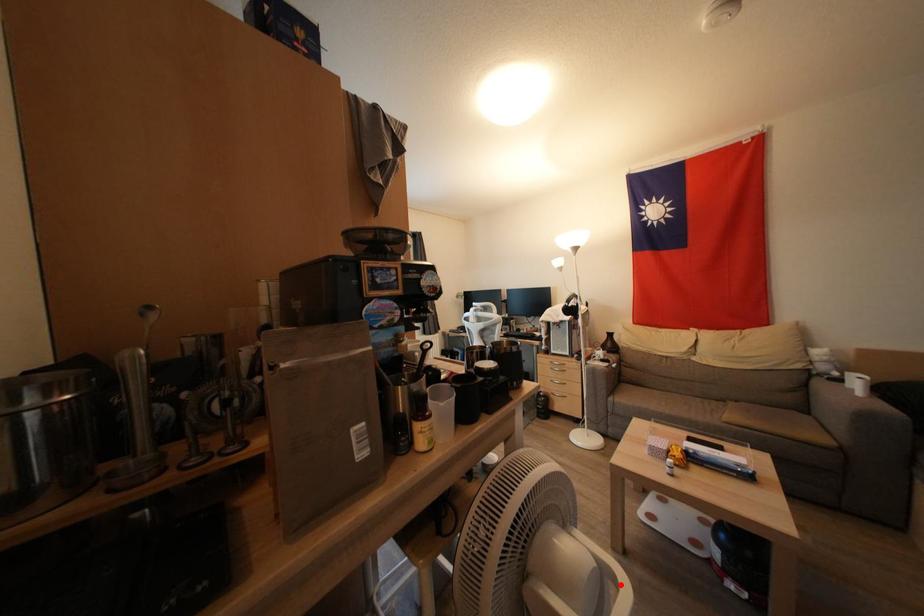
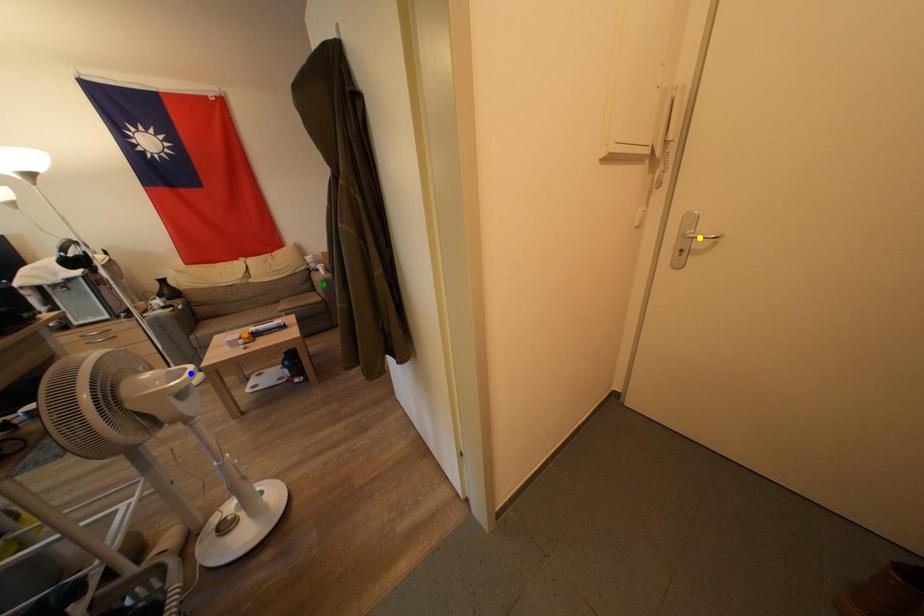
Question: I am providing you with two images of the same scene from different viewpoints. A red point is marked on the first image. You are given multiple points on the second image. Can you choose the point in image 2 that corresponds to the point in image 1?

Choices:
 (A) yellow point
 (B) blue point
 (C) green point

Answer: (B)